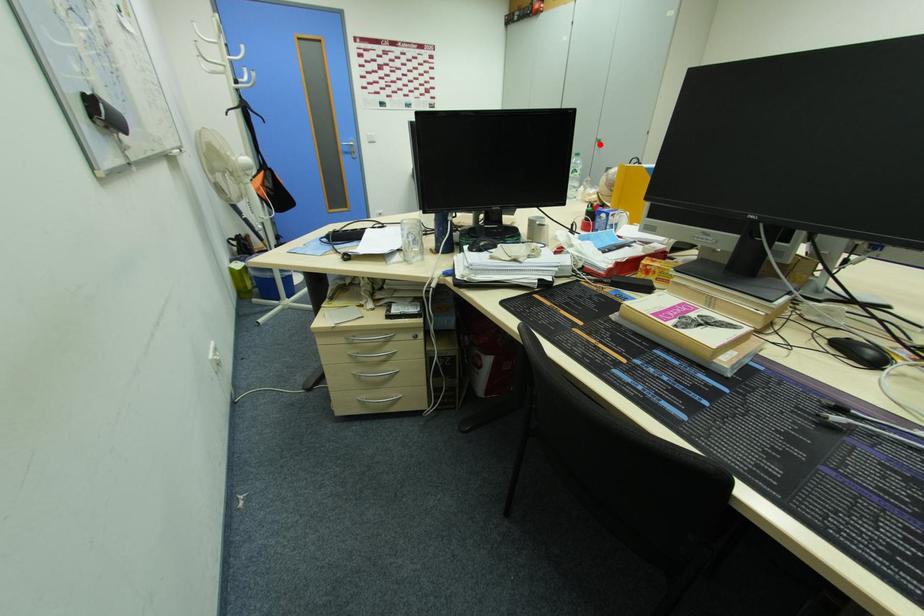
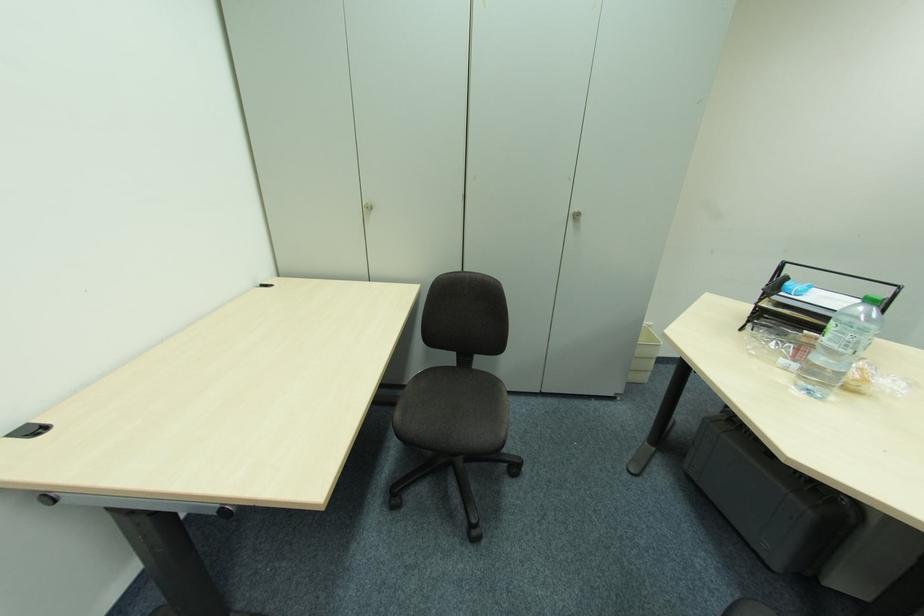
Question: I am providing you with two images of the same scene from different viewpoints. A red point is shown in image1. For the corresponding object point in image2, is it positioned nearer or farther from the camera?

Choices:
 (A) Nearer
 (B) Farther

Answer: (B)